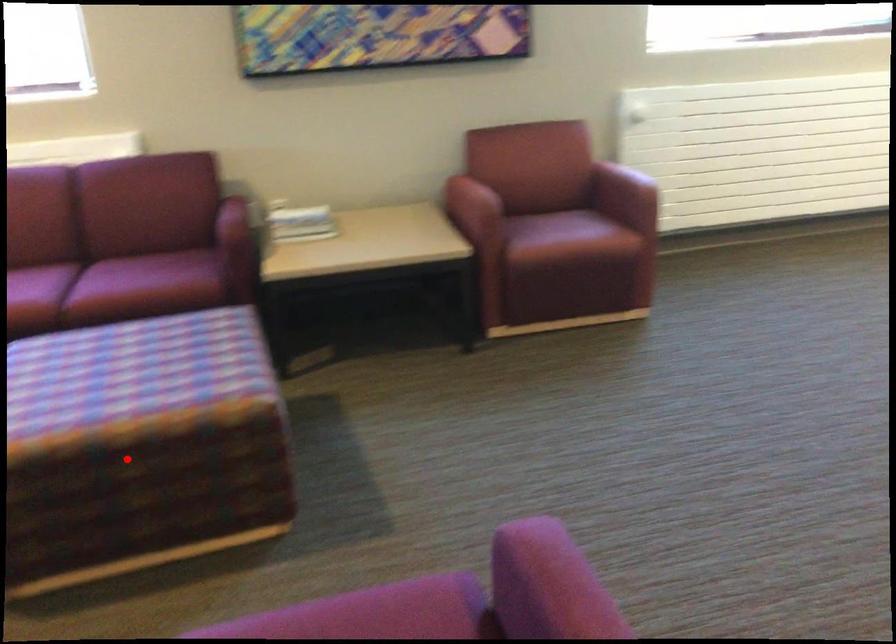
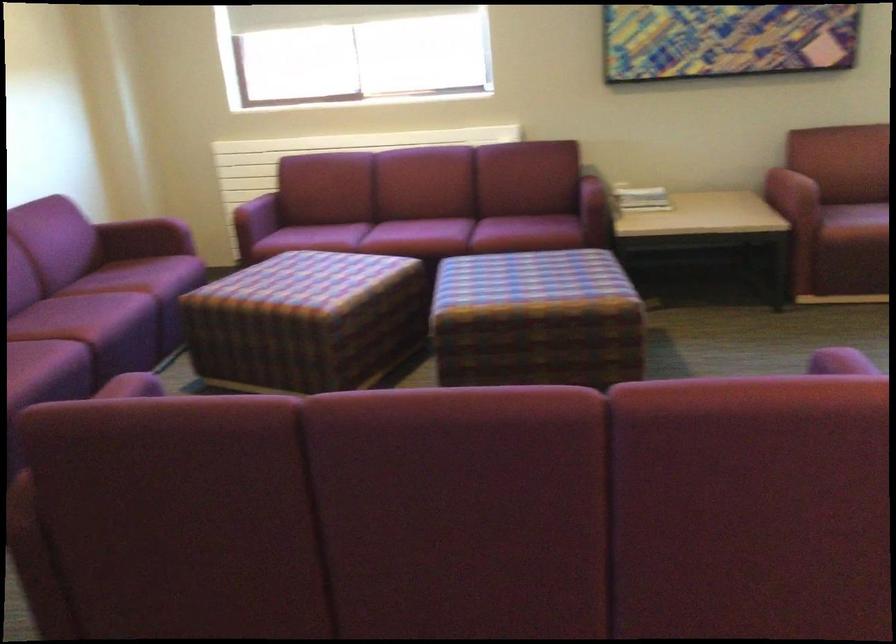
In the second image, find the point that corresponds to the highlighted location in the first image.

(536, 319)